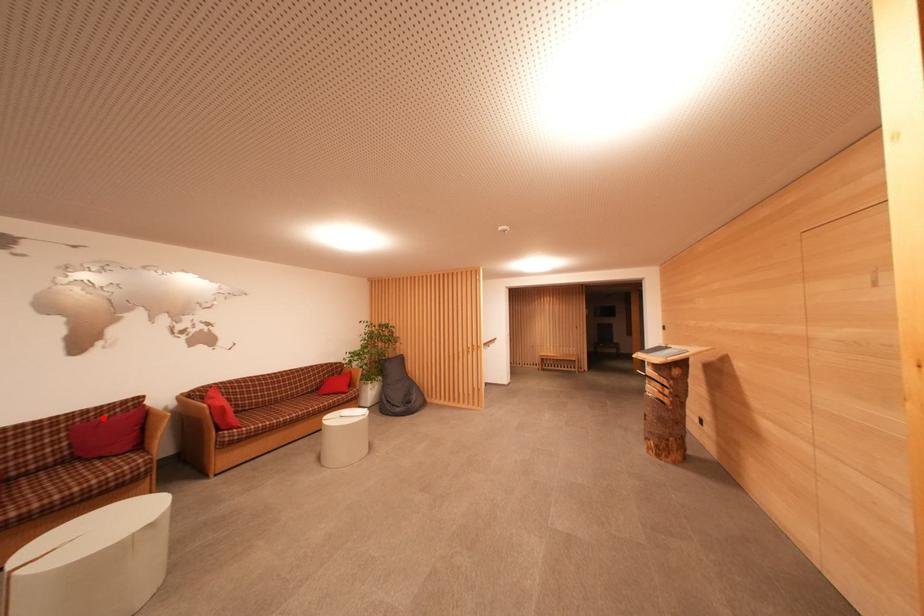
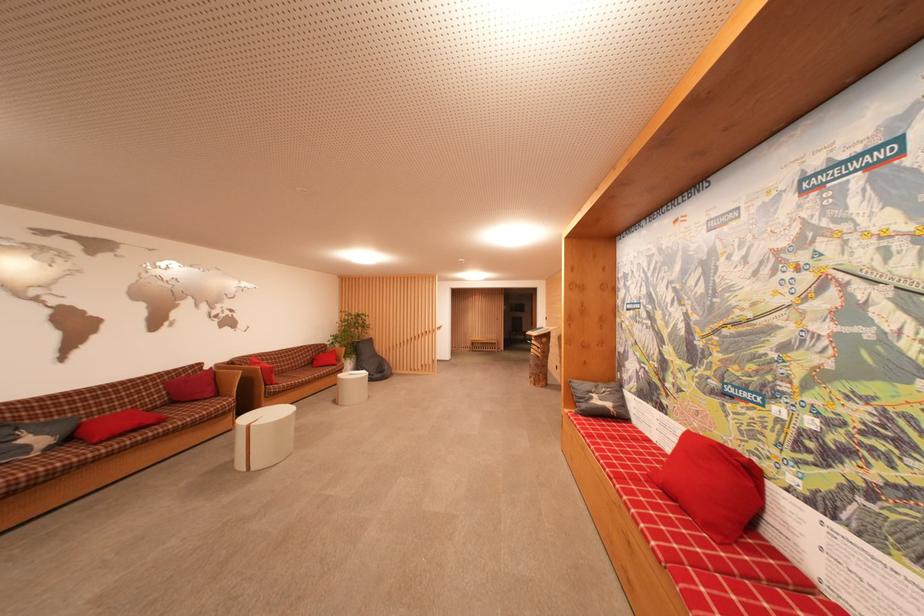
Question: I am providing you with two images of the same scene from different viewpoints. A red point is shown in image1. For the corresponding object point in image2, is it positioned nearer or farther from the camera?

Choices:
 (A) Nearer
 (B) Farther

Answer: (B)